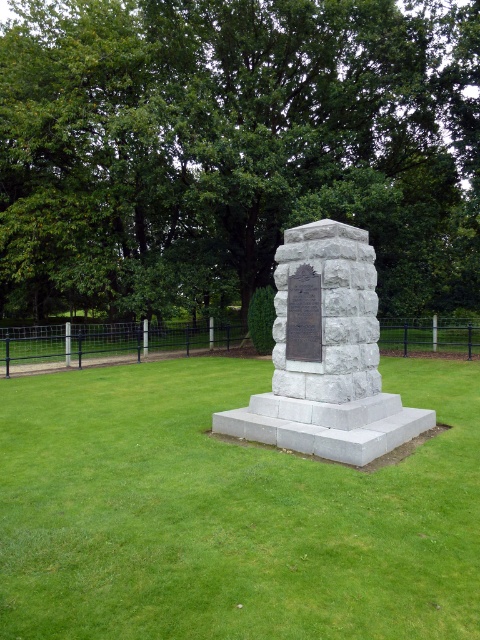
Question: Does green leafy tree at center appear over gray stone monument at center?

Choices:
 (A) no
 (B) yes

Answer: (B)

Question: Does green leafy tree at center have a lesser width compared to green grass at center?

Choices:
 (A) yes
 (B) no

Answer: (B)

Question: Can you confirm if green leafy tree at center is thinner than green grass at center?

Choices:
 (A) no
 (B) yes

Answer: (A)

Question: Which point appears closest to the camera in this image?

Choices:
 (A) (371, 256)
 (B) (395, 152)

Answer: (A)

Question: Which point is farther to the camera?

Choices:
 (A) (458, 272)
 (B) (128, 556)

Answer: (A)

Question: Which of the following is the closest to the observer?

Choices:
 (A) green leafy tree at center
 (B) green grass at center
 (C) gray stone monument at center

Answer: (B)